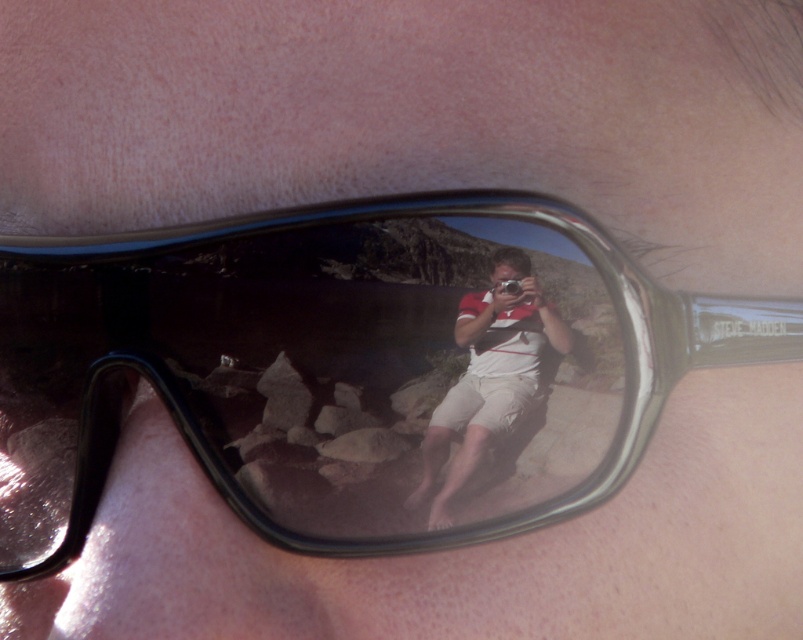
How distant is black plastic goggles at center from matte white shorts at center?

They are 3.12 inches apart.

Which is above, black plastic goggles at center or matte white shorts at center?

black plastic goggles at center is higher up.

The width and height of the screenshot is (803, 640). Find the location of `black plastic goggles at center`. black plastic goggles at center is located at coordinates (353, 369).